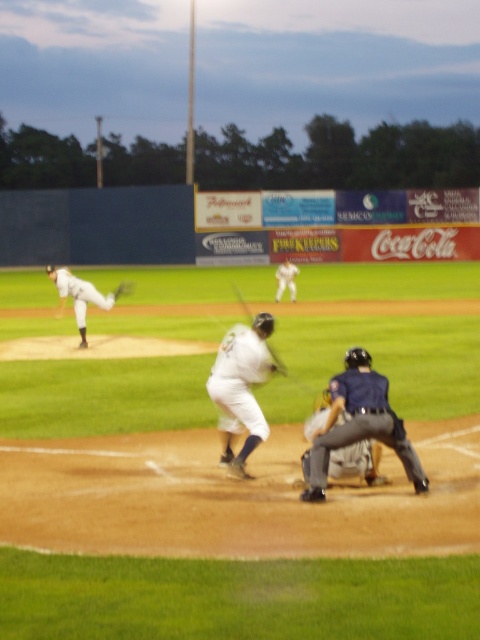
You are a photographer standing at the edge of the baseball field. You want to take a photo of the two points mentioned in the scene. Which point, point (x=231, y=452) or point (x=129, y=288), will appear larger in your photo?

Point (x=231, y=452) will appear larger in the photo because it is closer to the viewer than point (x=129, y=288).

Looking at this image, you are a photographer standing behind home plate and want to take a photo of the gray fabric catcher at center and the wooden baseball bat at center. Which object will appear larger in your photo?

The gray fabric catcher at center is closer to the viewer than the wooden baseball bat at center, so it will appear larger in the photo.